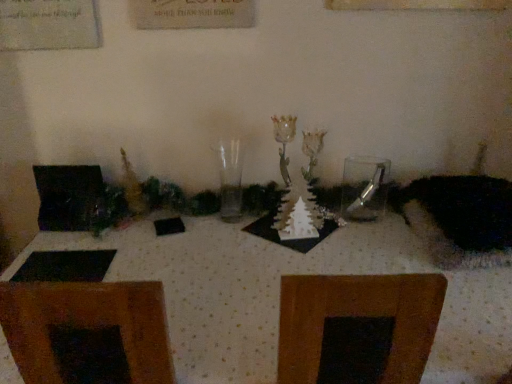
Image resolution: width=512 pixels, height=384 pixels. Identify the location of free point to the right of transparent glass vase at center. (x=262, y=212).